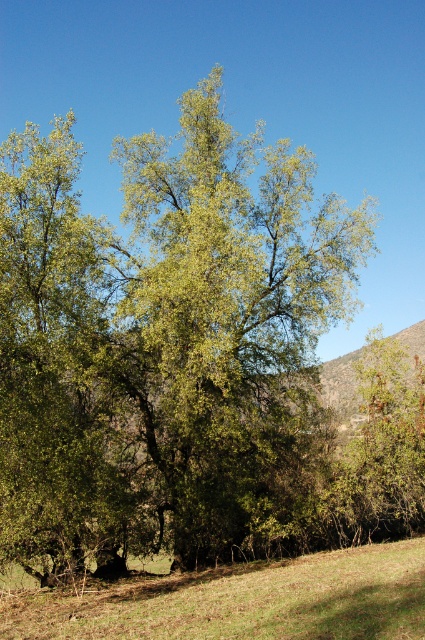
Question: Observing the image, what is the correct spatial positioning of green leafy tree at center in reference to green grassy field at lower center?

Choices:
 (A) left
 (B) right

Answer: (A)

Question: Which object is closer to the camera taking this photo?

Choices:
 (A) green grassy field at lower center
 (B) green leafy tree at center

Answer: (A)

Question: Is green leafy tree at center bigger than green grassy field at lower center?

Choices:
 (A) no
 (B) yes

Answer: (B)

Question: Among these points, which one is nearest to the camera?

Choices:
 (A) [345, 556]
 (B) [215, 285]

Answer: (B)

Question: Is green leafy tree at center bigger than green grassy field at lower center?

Choices:
 (A) no
 (B) yes

Answer: (B)